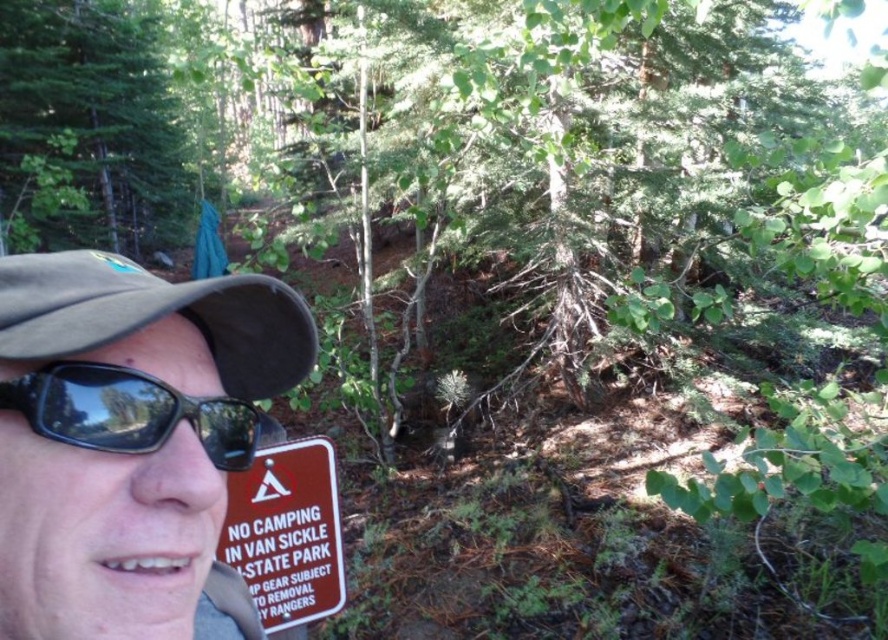
Is red plastic sign at lower left wider than black rubber sunglasses at left?

Indeed, red plastic sign at lower left has a greater width compared to black rubber sunglasses at left.

Can you confirm if red plastic sign at lower left is thinner than black rubber sunglasses at left?

No, red plastic sign at lower left is not thinner than black rubber sunglasses at left.

Is point (319, 584) less distant than point (62, 364)?

No, it is not.

This screenshot has width=888, height=640. I want to click on red plastic sign at lower left, so click(x=287, y=534).

Does brown fabric cap at left have a lesser width compared to black rubber sunglasses at left?

No, brown fabric cap at left is not thinner than black rubber sunglasses at left.

Describe the element at coordinates (155, 316) in the screenshot. The width and height of the screenshot is (888, 640). I see `brown fabric cap at left` at that location.

Between point (49, 276) and point (94, 428), which one is positioned behind?

Point (49, 276)

The image size is (888, 640). What are the coordinates of `brown fabric cap at left` in the screenshot? It's located at (155, 316).

Can you confirm if matte brown cap at upper left is taller than red plastic sign at lower left?

No, matte brown cap at upper left is not taller than red plastic sign at lower left.

Is matte brown cap at upper left thinner than red plastic sign at lower left?

Yes, matte brown cap at upper left is thinner than red plastic sign at lower left.

Describe the element at coordinates (104, 532) in the screenshot. I see `matte brown cap at upper left` at that location.

The width and height of the screenshot is (888, 640). In order to click on matte brown cap at upper left in this screenshot , I will do `click(104, 532)`.